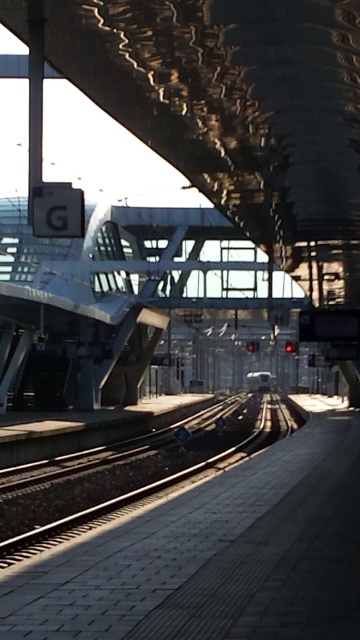
Does smooth concrete track at center appear on the right side of metallic silver train at center?

In fact, smooth concrete track at center is to the left of metallic silver train at center.

Which is behind, point (167, 480) or point (272, 381)?

The point (272, 381) is more distant.

This screenshot has width=360, height=640. I want to click on smooth concrete track at center, so click(x=146, y=490).